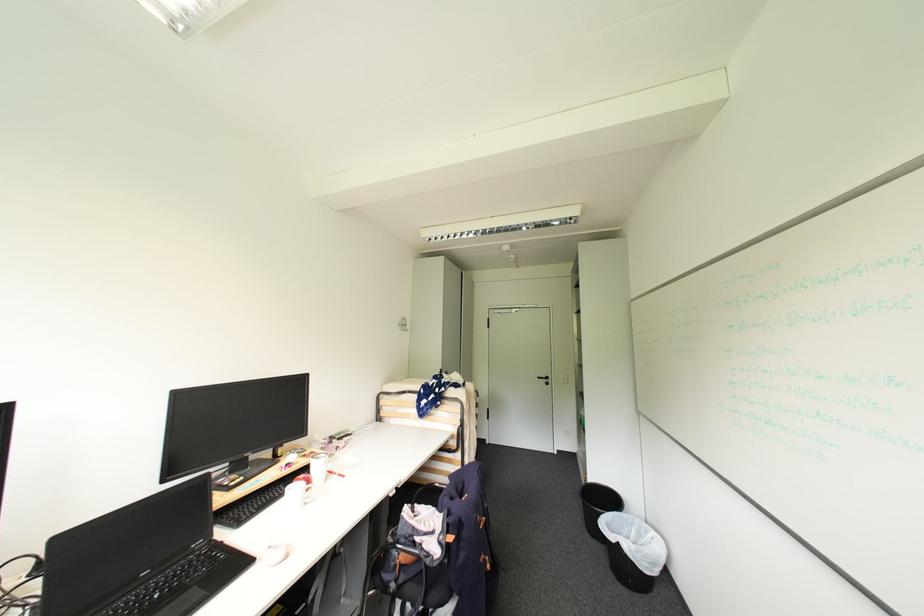
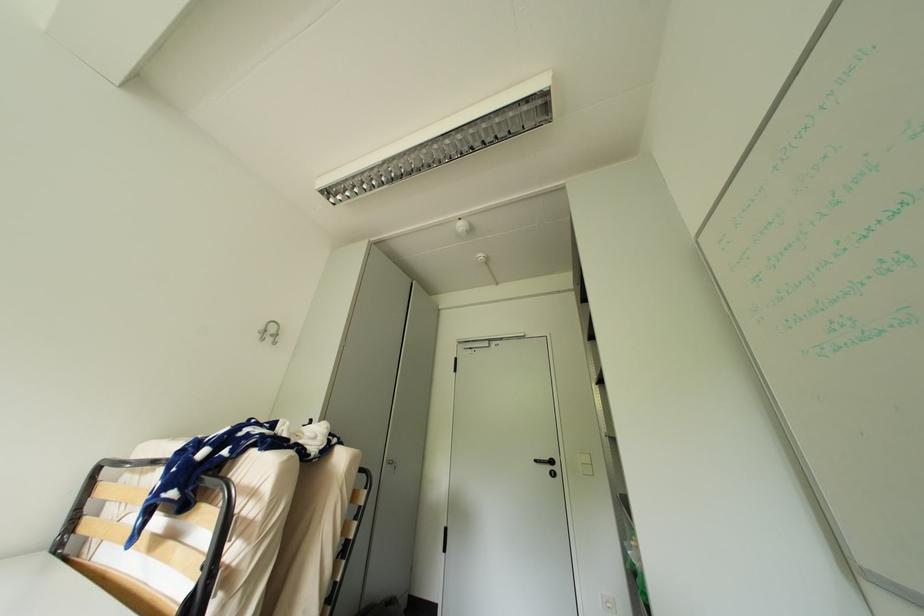
In a continuous first-person perspective shot, in which direction is the camera moving?

The cameraman moved toward right, forward.